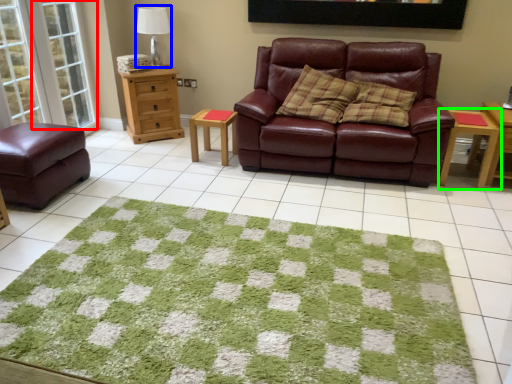
Question: Based on their relative distances, which object is nearer to glass door (highlighted by a red box)? Choose from table lamp (highlighted by a blue box) and table (highlighted by a green box).

Choices:
 (A) table lamp
 (B) table

Answer: (A)